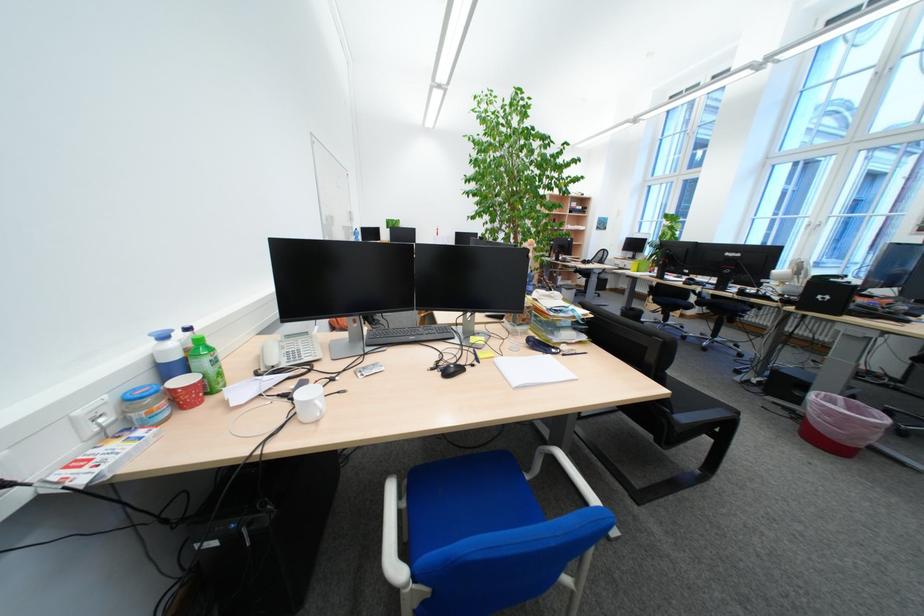
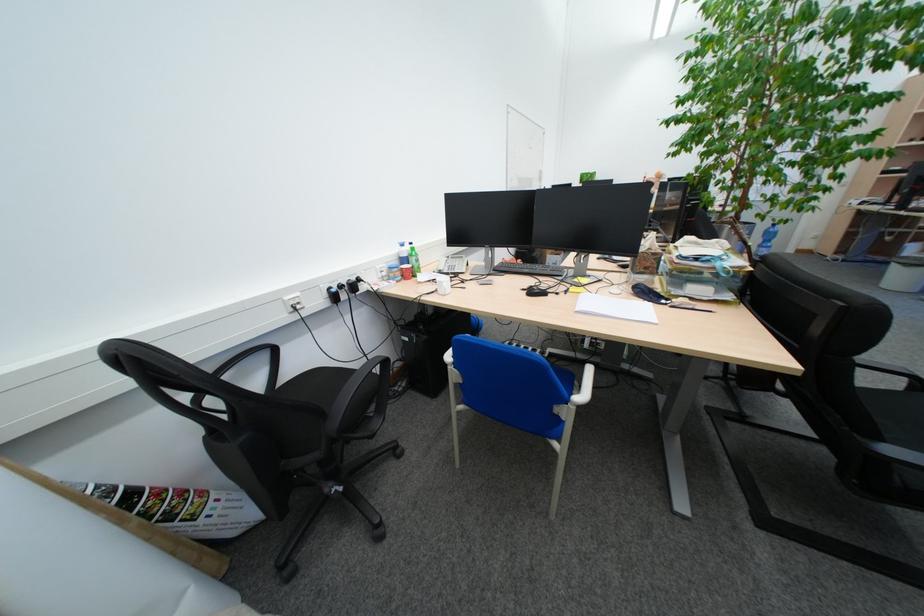
Where in the second image is the point corresponding to [444,367] from the first image?

(537, 288)